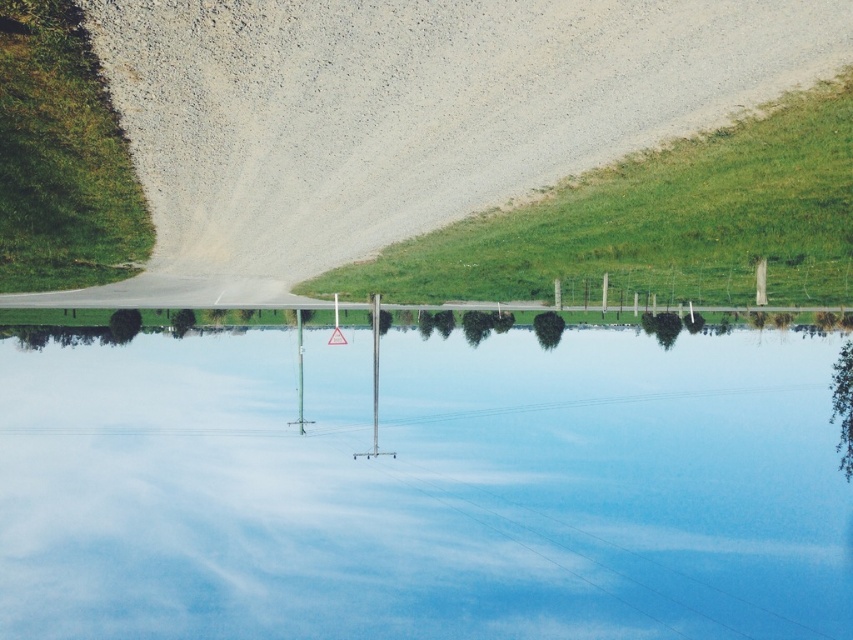
Is transparent glass lake at center thinner than green grass at upper right?

In fact, transparent glass lake at center might be wider than green grass at upper right.

Is transparent glass lake at center positioned behind green grass at upper right?

Yes, transparent glass lake at center is further from the viewer.

This screenshot has width=853, height=640. Describe the element at coordinates (421, 484) in the screenshot. I see `transparent glass lake at center` at that location.

The width and height of the screenshot is (853, 640). What are the coordinates of `transparent glass lake at center` in the screenshot? It's located at (421, 484).

Can you confirm if transparent glass lake at center is smaller than green grass at left?

No, transparent glass lake at center is not smaller than green grass at left.

Does transparent glass lake at center appear over green grass at left?

Incorrect, transparent glass lake at center is not positioned above green grass at left.

Does point (425, 368) come farther from viewer compared to point (128, 188)?

Yes, it is.

Locate an element on the screen. Image resolution: width=853 pixels, height=640 pixels. transparent glass lake at center is located at coordinates (421, 484).

Is green grass at upper right closer to camera compared to green grass at left?

No, green grass at upper right is behind green grass at left.

Can you confirm if green grass at upper right is positioned to the right of green grass at left?

Indeed, green grass at upper right is positioned on the right side of green grass at left.

Which is behind, point (786, 236) or point (0, 182)?

Point (786, 236)

This screenshot has height=640, width=853. I want to click on green grass at upper right, so click(659, 221).